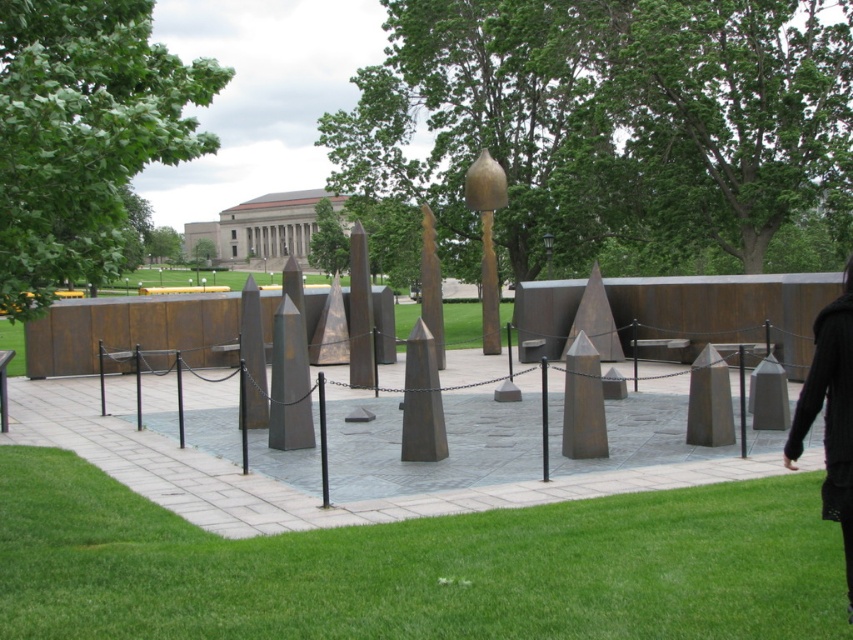
Is green grass at lower center positioned behind black wool coat at lower right?

Yes, green grass at lower center is behind black wool coat at lower right.

Is the position of green grass at lower center less distant than that of black wool coat at lower right?

No, it is not.

Identify the location of green grass at lower center. (419, 566).

Can you confirm if black wool coat at lower right is bigger than gold matte obelisk at center?

Actually, black wool coat at lower right might be smaller than gold matte obelisk at center.

Between black wool coat at lower right and gold matte obelisk at center, which one has more height?

gold matte obelisk at center

Which is behind, point (846, 461) or point (485, 180)?

The point (485, 180) is more distant.

Where is `black wool coat at lower right`? The height and width of the screenshot is (640, 853). black wool coat at lower right is located at coordinates (830, 413).

Consider the image. Does green grass at lower center have a lesser width compared to gold matte obelisk at center?

No, green grass at lower center is not thinner than gold matte obelisk at center.

In the scene shown: Between green grass at lower center and gold matte obelisk at center, which one has more height?

gold matte obelisk at center is taller.

I want to click on green grass at lower center, so click(x=419, y=566).

Image resolution: width=853 pixels, height=640 pixels. What are the coordinates of `green grass at lower center` in the screenshot? It's located at (419, 566).